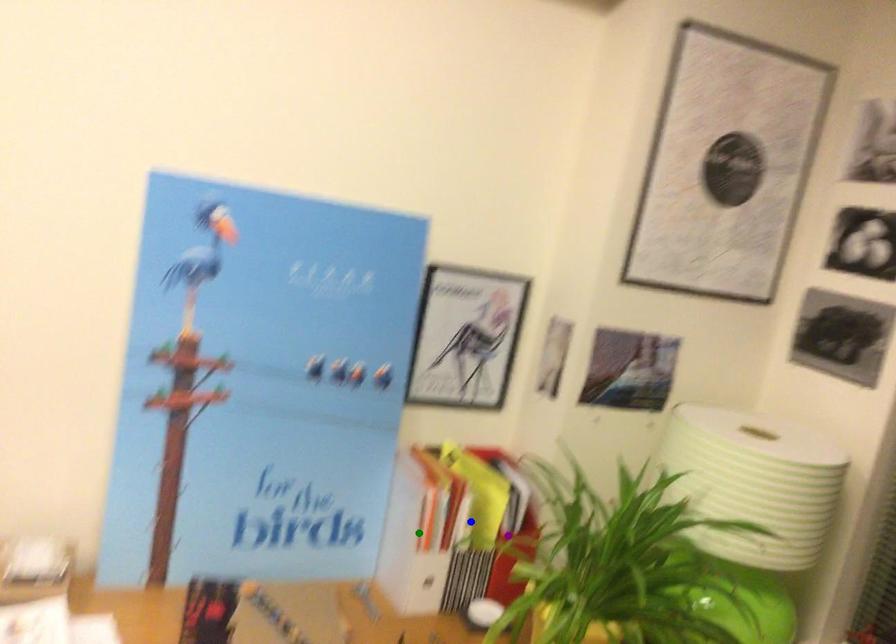
Based on the photo, order these from nearest to farthest:
blue point | green point | purple point

green point
blue point
purple point